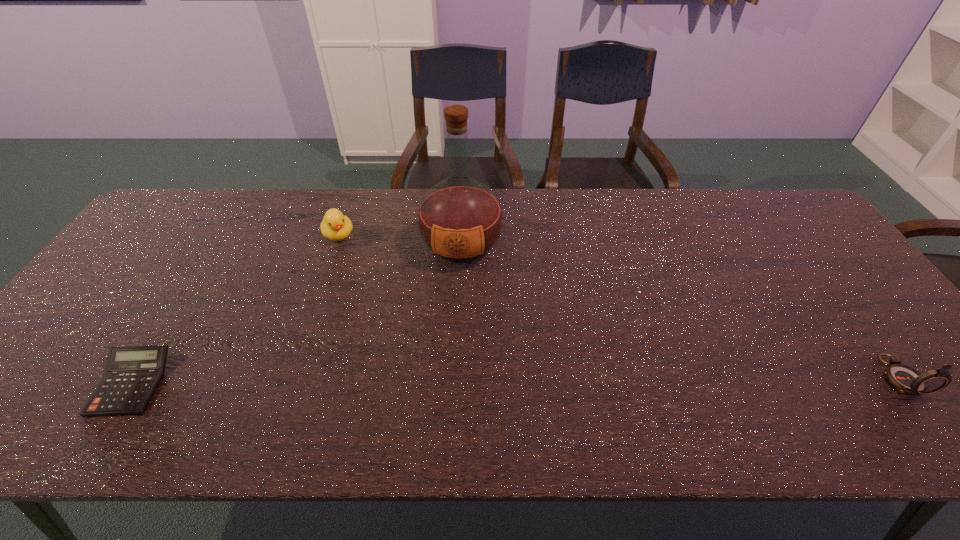
Locate an element on the screen. The height and width of the screenshot is (540, 960). the shortest object is located at coordinates (132, 375).

You are a GUI agent. You are given a task and a screenshot of the screen. Output one action in this format:
    pyautogui.click(x=<x>, y=<y>)
    Task: Click on the calculator
    This screenshot has height=540, width=960.
    Given the screenshot: What is the action you would take?
    pyautogui.click(x=132, y=375)

This screenshot has height=540, width=960. I want to click on the rightmost object, so click(904, 378).

The width and height of the screenshot is (960, 540). I want to click on the tallest object, so click(460, 220).

At what (x,y) coordinates should I click in order to perform the action: click on liquor. Please return your answer as a coordinate pair (x, y). The width and height of the screenshot is (960, 540). Looking at the image, I should click on (460, 220).

I want to click on the second object from left to right, so click(x=335, y=226).

The width and height of the screenshot is (960, 540). I want to click on free spot located 0.140m on the back of the calculator, so click(178, 308).

What are the coordinates of `vacant space located 0.110m on the front label of the third object from left to right` in the screenshot? It's located at [455, 304].

Find the location of a particular element. Image resolution: width=960 pixels, height=540 pixels. free space located 0.370m on the front label of the third object from left to right is located at coordinates (446, 393).

What are the coordinates of `vacant area located 0.300m on the front label of the third object from left to right` in the screenshot? It's located at (449, 366).